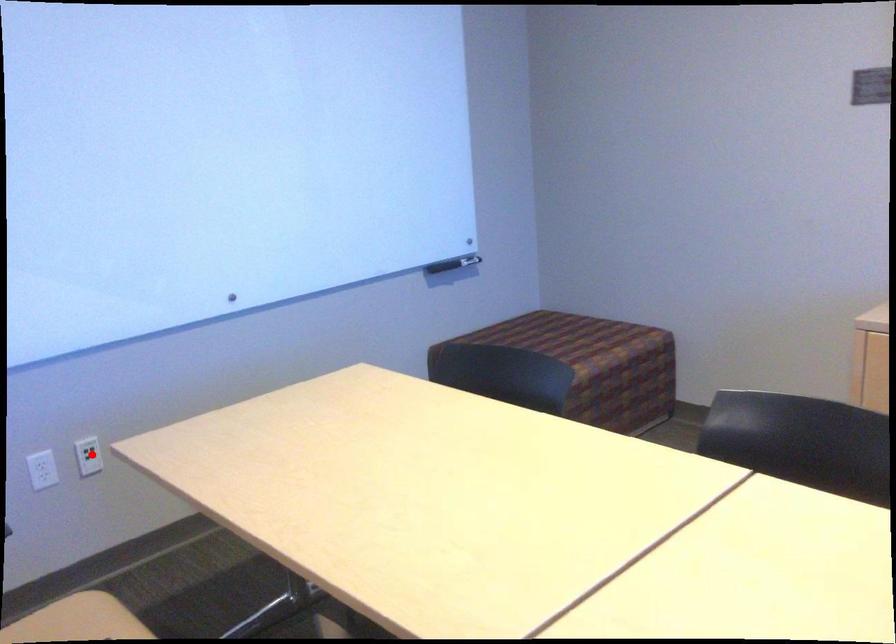
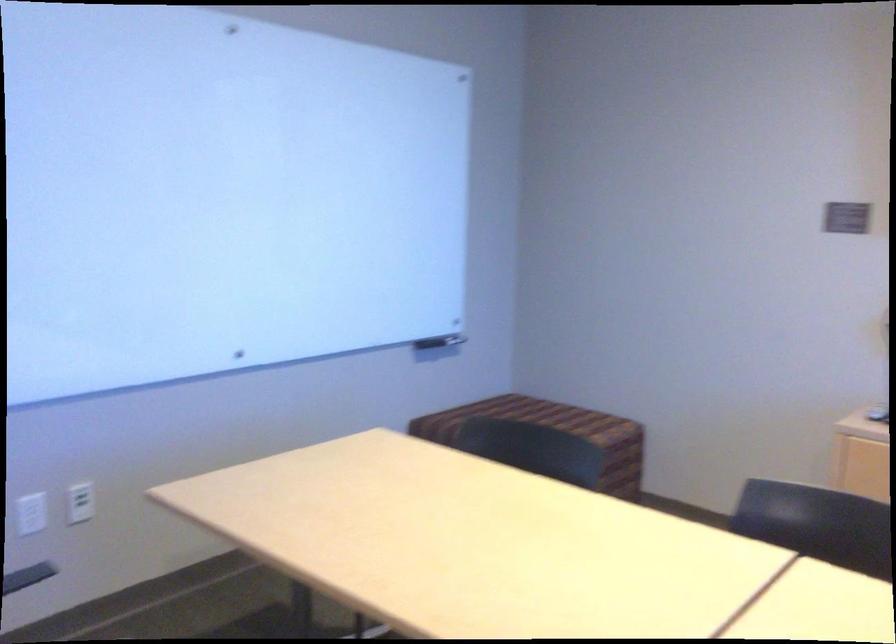
Find the pixel in the second image that matches the highlighted location in the first image.

(80, 502)